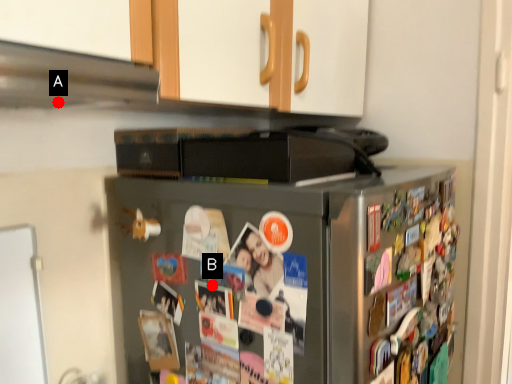
Question: Two points are circled on the image, labeled by A and B beside each circle. Which of the following is the closest to the observer?

Choices:
 (A) A is closer
 (B) B is closer

Answer: (A)